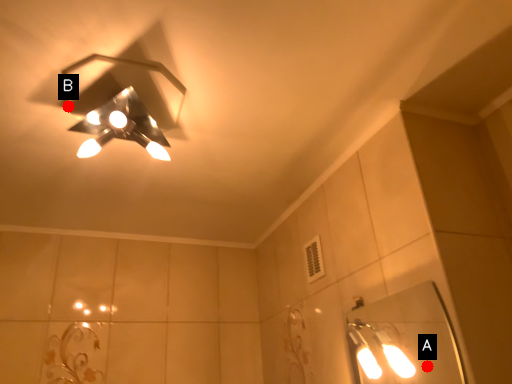
Question: Two points are circled on the image, labeled by A and B beside each circle. Which point is closer to the camera taking this photo?

Choices:
 (A) A is closer
 (B) B is closer

Answer: (B)